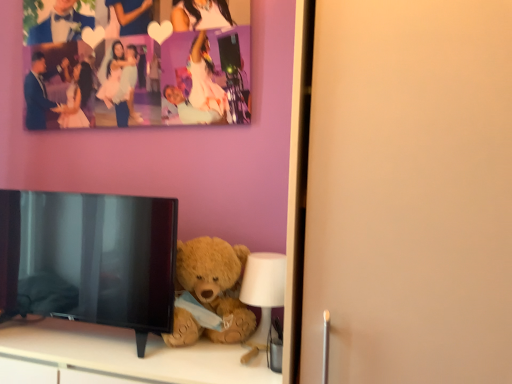
Question: Is fuzzy brown teddy bear at lower center taller or shorter than black glossy tv at lower left?

Choices:
 (A) tall
 (B) short

Answer: (B)

Question: Would you say fuzzy brown teddy bear at lower center is to the left or to the right of black glossy tv at lower left in the picture?

Choices:
 (A) left
 (B) right

Answer: (B)

Question: Estimate the real-world distances between objects in this image. Which object is closer to the white plastic lamp at lower center?

Choices:
 (A) fuzzy brown teddy bear at lower center
 (B) soft beige teddy bear at lower center
 (C) black glossy tv at lower left

Answer: (A)

Question: Estimate the real-world distances between objects in this image. Which object is closer to the black glossy tv at lower left?

Choices:
 (A) soft beige teddy bear at lower center
 (B) fuzzy brown teddy bear at lower center
 (C) white plastic lamp at lower center

Answer: (A)